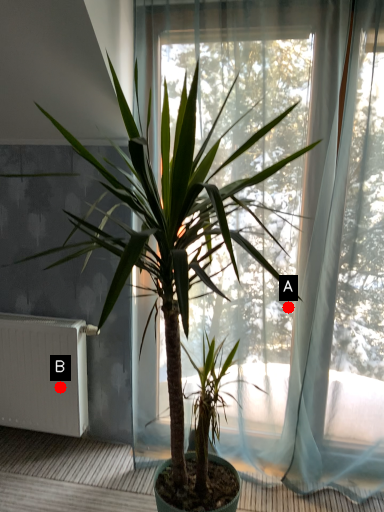
Question: Two points are circled on the image, labeled by A and B beside each circle. Among these points, which one is farthest from the camera?

Choices:
 (A) A is further
 (B) B is further

Answer: (B)